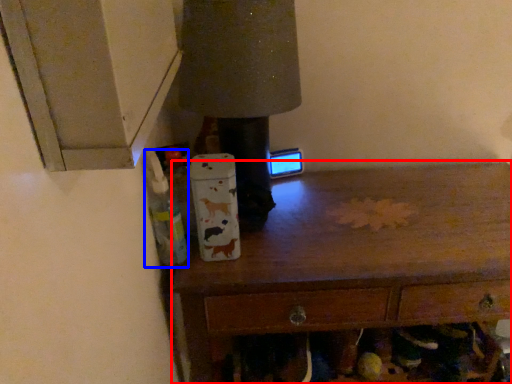
Question: Which of the following is the closest to the observer, chest of drawers (highlighted by a red box) or bottle (highlighted by a blue box)?

Choices:
 (A) chest of drawers
 (B) bottle

Answer: (B)